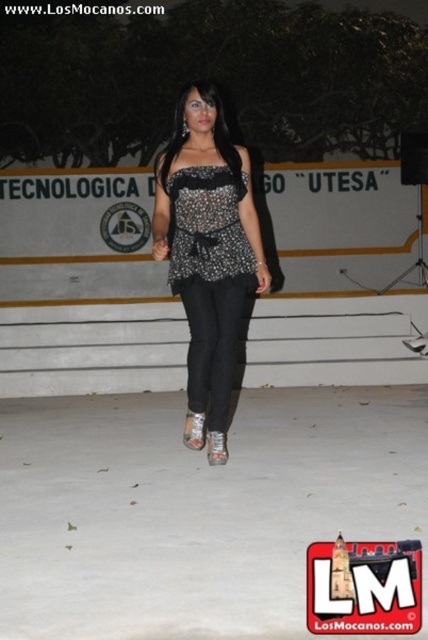
In the scene shown: Who is positioned more to the right, sparkly black top at center or sparkly sequined dress at center?

From the viewer's perspective, sparkly sequined dress at center appears more on the right side.

Who is taller, sparkly black top at center or sparkly sequined dress at center?

sparkly black top at center is taller.

Is point (199, 212) behind point (237, 253)?

No, it is in front of (237, 253).

This screenshot has height=640, width=428. Find the location of `sparkly black top at center`. sparkly black top at center is located at coordinates [x=208, y=253].